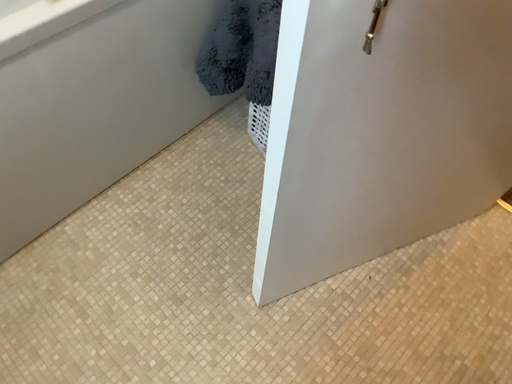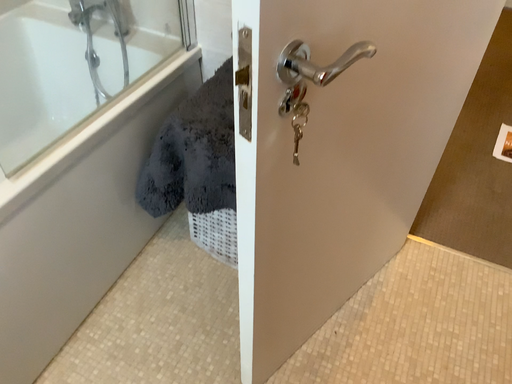
Question: How did the camera likely rotate when shooting the video?

Choices:
 (A) rotated left
 (B) rotated right

Answer: (B)